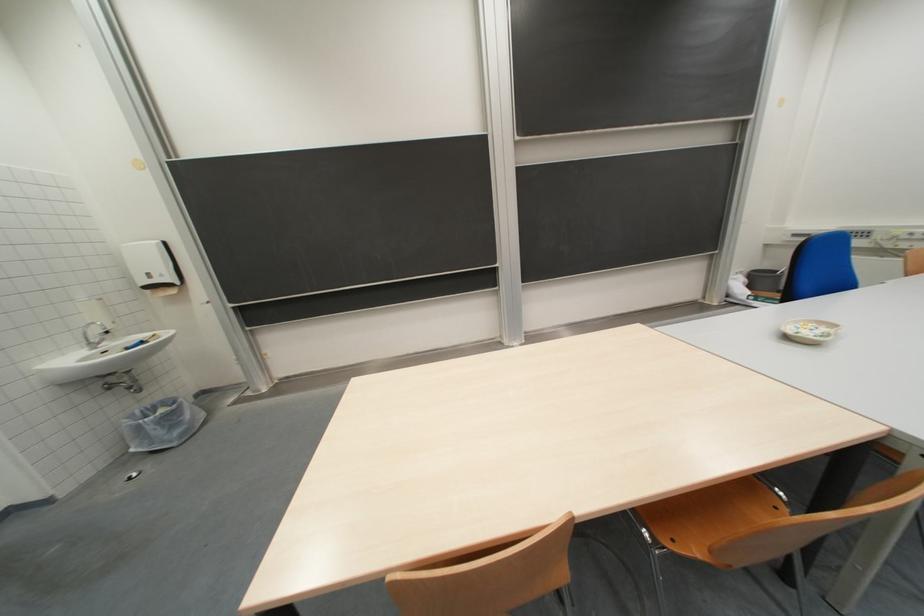
Describe the element at coordinates (710, 515) in the screenshot. This screenshot has height=616, width=924. I see `the chair sitting surface` at that location.